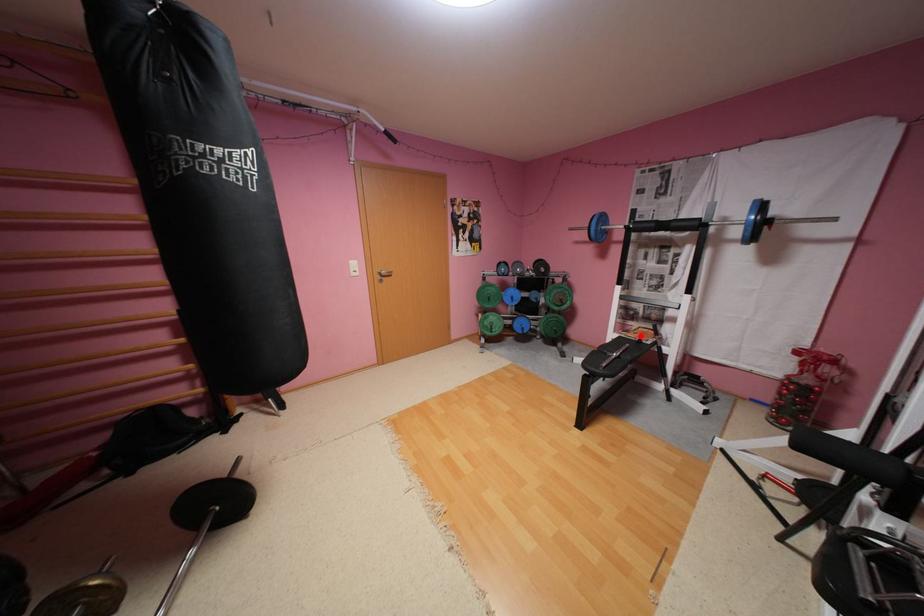
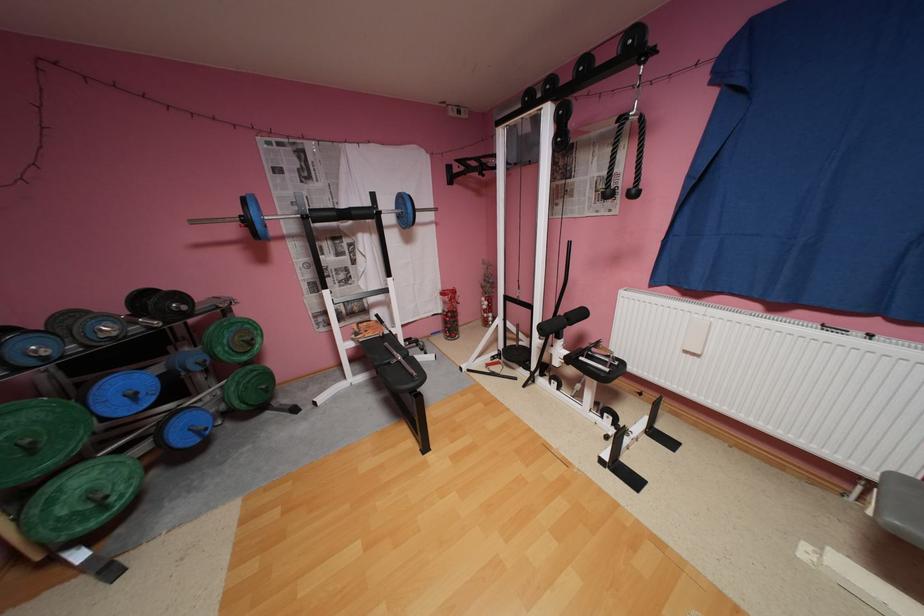
The point at the highlighted location is marked in the first image. Where is the corresponding point in the second image?

(380, 334)